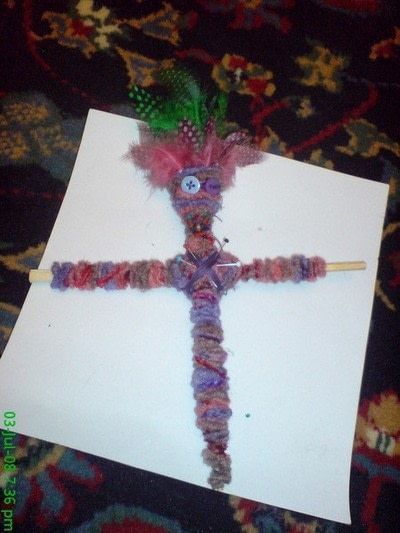
Identify the location of carpet. Image resolution: width=400 pixels, height=533 pixels. pos(340,80).